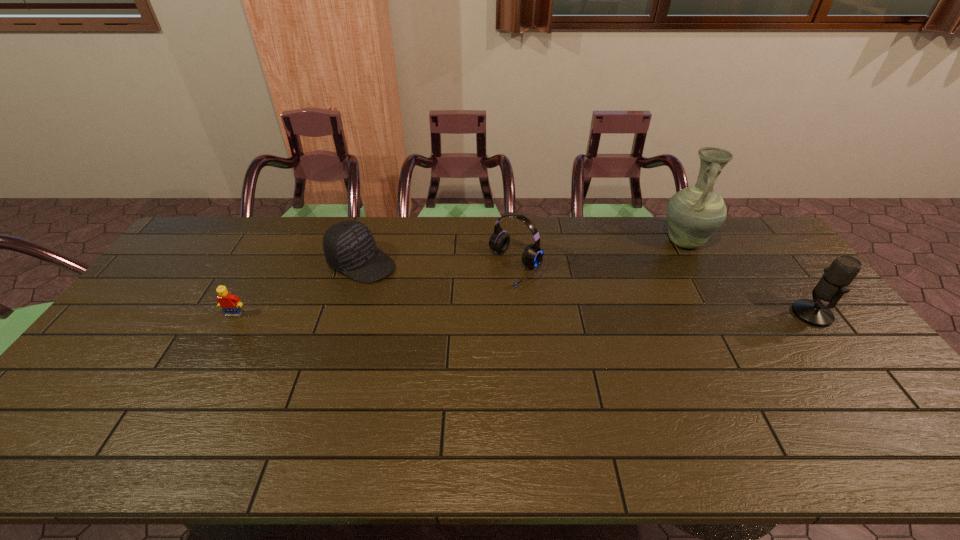
What are the coordinates of `pitcher that is at the far edge` in the screenshot? It's located at (694, 213).

Image resolution: width=960 pixels, height=540 pixels. In order to click on object that is at the right edge in this screenshot , I will do `click(835, 282)`.

In the image, there is a desktop. Where is `vacant space at the far edge`? vacant space at the far edge is located at coordinates (614, 217).

Identify the location of vacant space at the near edge of the desktop. (335, 389).

Find the location of a particular element. vacant space at the left edge is located at coordinates (184, 300).

I want to click on vacant space at the right edge of the desktop, so coord(849,360).

What are the coordinates of `free location at the far right corner` in the screenshot? It's located at (736, 251).

The image size is (960, 540). Identify the location of vacant space at the near right corner of the desktop. (861, 395).

Find the location of a particular element. vacant point located between the headset and the microphone is located at coordinates (664, 291).

You are a GUI agent. You are given a task and a screenshot of the screen. Output one action in this format:
    pyautogui.click(x=<x>, y=<y>)
    Task: Click on the free space between the second object from right to left and the rightmost object
    Image resolution: width=960 pixels, height=540 pixels.
    Given the screenshot: What is the action you would take?
    pyautogui.click(x=748, y=278)